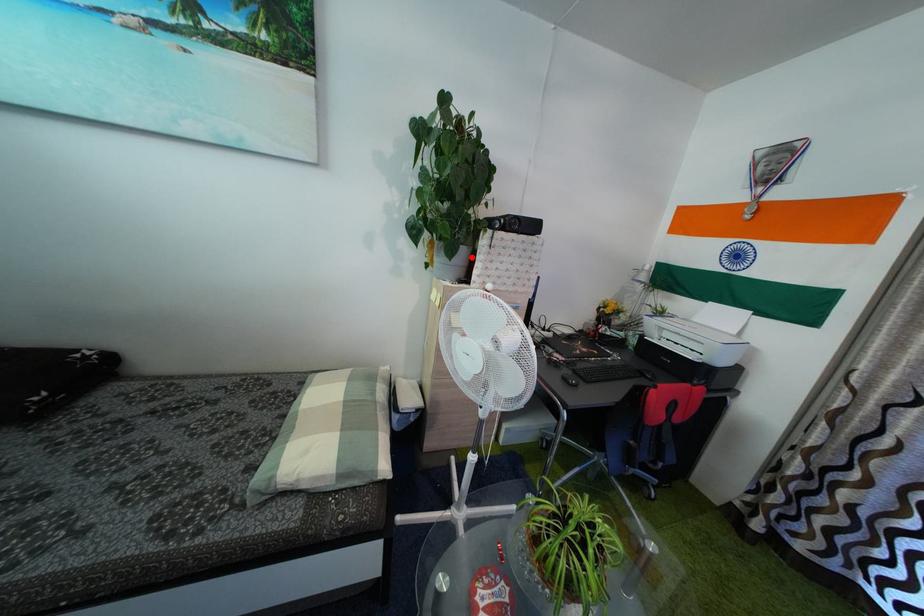
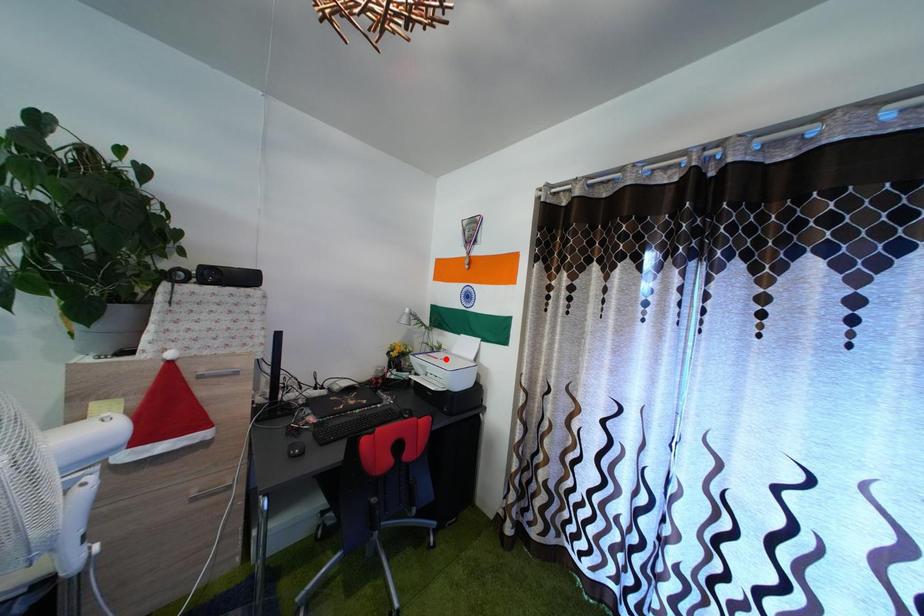
I am providing you with two images of the same scene from different viewpoints. A red point is marked on the first image and another point is marked on the second image. Are the points marked in image1 and image2 representing the same 3D position?

No